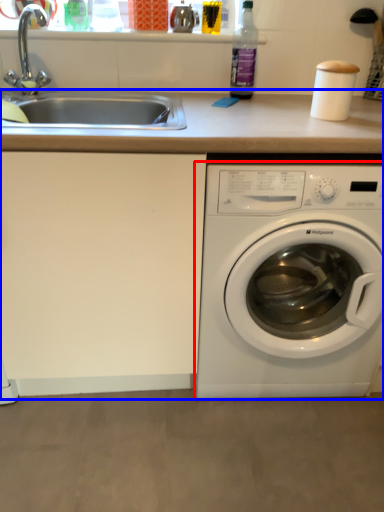
Question: Which point is closer to the camera, washing machine (highlighted by a red box) or counter top (highlighted by a blue box)?

Choices:
 (A) washing machine
 (B) counter top

Answer: (B)